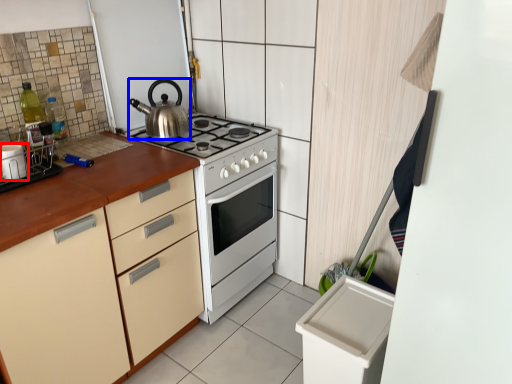
Question: Which of the following is the closest to the observer, kitchen appliance (highlighted by a red box) or kettle (highlighted by a blue box)?

Choices:
 (A) kitchen appliance
 (B) kettle

Answer: (A)